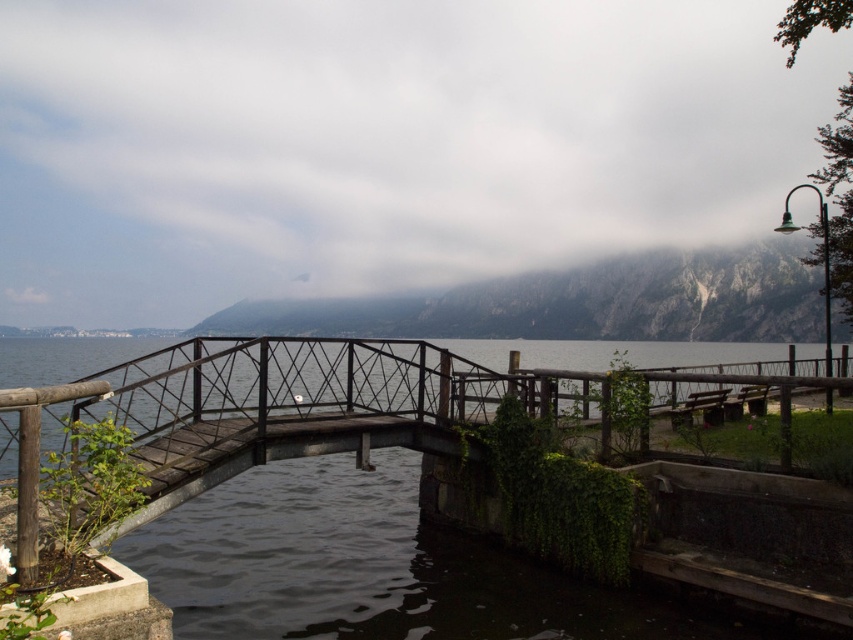
You are standing at the curved wooden bridge and want to determine which of the two points, point (340, 433) or point (616, 300), is nearer to you. Based on the scene, which point is closer?

Point (340, 433) is closer to the viewer than point (616, 300).

Consider the image. You are standing at the lakeside and want to take a photo of the rusty metal bridge at center and the rocky gray mountain at upper center. Which object will appear larger in the photo?

The rusty metal bridge at center will appear larger in the photo because it is closer to the viewer than the rocky gray mountain at upper center.

You are an architect designing a new pathway. You need to decide whether to place a wide walkway between the rusty metal bridge at center and the rocky gray mountain at upper center. Based on their widths, which object should the walkway be placed closer to?

The rusty metal bridge at center is thinner than the rocky gray mountain at upper center, so the walkway should be placed closer to the rusty metal bridge at center to ensure it accommodates the wider structure.